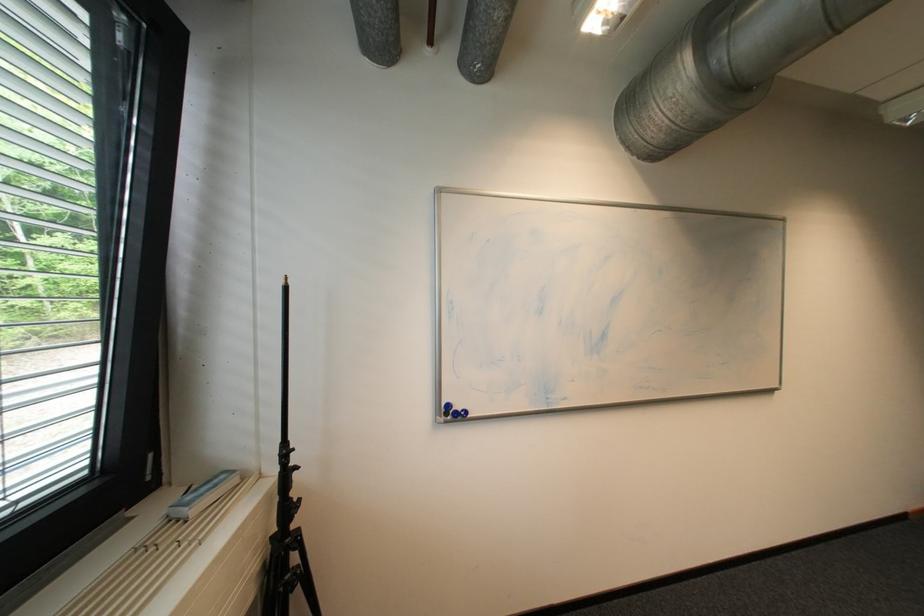
The image size is (924, 616). I want to click on tripod adjustment knob, so click(x=287, y=541).